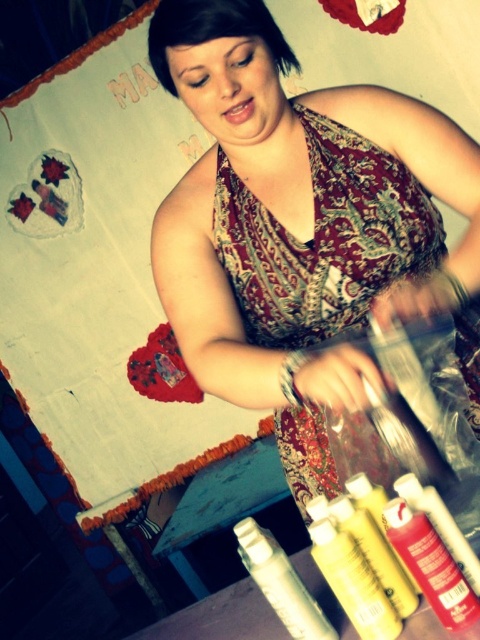
Looking at this image, who is more forward, (x=362, y=560) or (x=288, y=614)?

Point (x=362, y=560) is more forward.

This screenshot has width=480, height=640. In order to click on yellow matte paint at lower center in this screenshot , I will do `click(352, 582)`.

Measure the distance between point (x=352, y=200) and camera.

A distance of 38.88 inches exists between point (x=352, y=200) and camera.

Is matte floral dress at center positioned before matte red spray can at lower right?

That is False.

Does point (194, 240) come farther from viewer compared to point (460, 577)?

Yes, point (194, 240) is behind point (460, 577).

Where is `matte floral dress at center`? matte floral dress at center is located at coordinates (299, 224).

Looking at this image, which of these two, matte red spray can at lower right or yellow matte paint at lower center, stands shorter?

matte red spray can at lower right

Between point (440, 579) and point (384, 593), which one is positioned behind?

Point (384, 593)

Which is behind, point (434, 529) or point (391, 630)?

Positioned behind is point (391, 630).

Identify the location of matte red spray can at lower right. (431, 564).